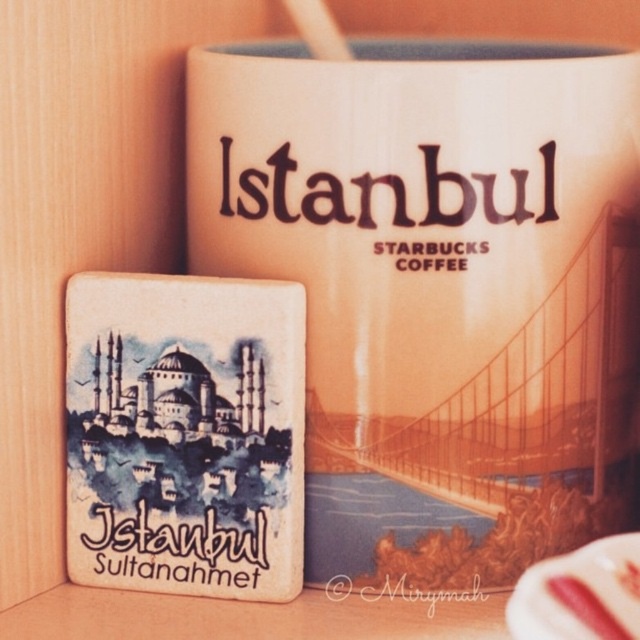
This screenshot has width=640, height=640. Identify the location of matte ceramic mug at upper center. (435, 284).

Find the location of a particular element. This screenshot has height=640, width=640. matte ceramic mug at upper center is located at coordinates (435, 284).